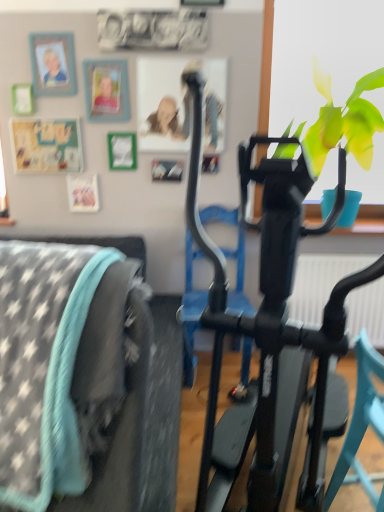
Image resolution: width=384 pixels, height=512 pixels. I want to click on wooden photo frame at upper left, marked as the second picture frame in a right-to-left arrangement, so click(x=53, y=64).

In order to face green leafy plant at upper right, should I rotate leftwards or rightwards?

To face it directly, rotate right by 18.413 degrees.

What do you see at coordinates (343, 122) in the screenshot? The height and width of the screenshot is (512, 384). I see `green leafy plant at upper right` at bounding box center [343, 122].

What is the approximate width of black matte stationary bicycle at center?

The width of black matte stationary bicycle at center is 1.34 meters.

At what (x,y) coordinates should I click in order to perform the action: click on black matte stationary bicycle at center. Please return your answer as a coordinate pair (x, y). The width and height of the screenshot is (384, 512). Looking at the image, I should click on (269, 306).

The height and width of the screenshot is (512, 384). I want to click on matte plastic picture frame at upper left, positioned as the 1th picture frame in right-to-left order, so [106, 90].

Locate an element on the screen. wooden photo frame at upper left, the 1th picture frame in the left-to-right sequence is located at coordinates (53, 64).

From their relative heights in the image, would you say wooden photo frame at upper left, the 1th picture frame in the left-to-right sequence, is taller or shorter than matte plastic picture frame at upper left, the 2th picture frame positioned from the left?

Clearly, wooden photo frame at upper left, the 1th picture frame in the left-to-right sequence, is shorter compared to matte plastic picture frame at upper left, the 2th picture frame positioned from the left.

Is wooden photo frame at upper left, marked as the second picture frame in a right-to-left arrangement, touching matte plastic picture frame at upper left, positioned as the 1th picture frame in right-to-left order?

No, wooden photo frame at upper left, marked as the second picture frame in a right-to-left arrangement, is not making contact with matte plastic picture frame at upper left, positioned as the 1th picture frame in right-to-left order.

Who is smaller, wooden photo frame at upper left, the 1th picture frame in the left-to-right sequence, or matte plastic picture frame at upper left, positioned as the 1th picture frame in right-to-left order?

With smaller size is wooden photo frame at upper left, the 1th picture frame in the left-to-right sequence.

Is wooden photo frame at upper left, marked as the second picture frame in a right-to-left arrangement, turned away from matte plastic picture frame at upper left, positioned as the 1th picture frame in right-to-left order?

No, wooden photo frame at upper left, marked as the second picture frame in a right-to-left arrangement,'s orientation is not away from matte plastic picture frame at upper left, positioned as the 1th picture frame in right-to-left order.

Can you confirm if wooden photo frame at upper left, the 1th picture frame in the left-to-right sequence, is positioned to the left of teal plastic chair at center?

Yes, wooden photo frame at upper left, the 1th picture frame in the left-to-right sequence, is to the left of teal plastic chair at center.

Who is shorter, wooden photo frame at upper left, marked as the second picture frame in a right-to-left arrangement, or teal plastic chair at center?

Standing shorter between the two is wooden photo frame at upper left, marked as the second picture frame in a right-to-left arrangement.

Is wooden photo frame at upper left, marked as the second picture frame in a right-to-left arrangement, in front of teal plastic chair at center?

That is False.

Are black matte stationary bicycle at center and green leafy plant at upper right beside each other?

No, black matte stationary bicycle at center is not with green leafy plant at upper right.

Is black matte stationary bicycle at center closer to camera compared to green leafy plant at upper right?

Yes.

Considering the relative positions of black matte stationary bicycle at center and green leafy plant at upper right in the image provided, is black matte stationary bicycle at center to the left of green leafy plant at upper right from the viewer's perspective?

Correct, you'll find black matte stationary bicycle at center to the left of green leafy plant at upper right.

From the image's perspective, which one is positioned lower, black matte stationary bicycle at center or green leafy plant at upper right?

black matte stationary bicycle at center.

From the image's perspective, would you say matte plastic picture frame at upper left, positioned as the 1th picture frame in right-to-left order, is positioned over green leafy plant at upper right?

Correct, matte plastic picture frame at upper left, positioned as the 1th picture frame in right-to-left order, appears higher than green leafy plant at upper right in the image.

The width and height of the screenshot is (384, 512). What are the coordinates of `picture frame directly beneath the green leafy plant at upper right (from a real-world perspective)` in the screenshot? It's located at (106, 90).

From a real-world perspective, is matte plastic picture frame at upper left, the 2th picture frame positioned from the left, above or below green leafy plant at upper right?

In terms of real-world spatial position, matte plastic picture frame at upper left, the 2th picture frame positioned from the left, is below green leafy plant at upper right.

Is matte plastic picture frame at upper left, positioned as the 1th picture frame in right-to-left order, far away from green leafy plant at upper right?

Yes.

In order to click on the 1st picture frame behind the green leafy plant at upper right, counting from the anchor's position in this screenshot , I will do `click(53, 64)`.

Which of these two, wooden photo frame at upper left, marked as the second picture frame in a right-to-left arrangement, or green leafy plant at upper right, is smaller?

wooden photo frame at upper left, marked as the second picture frame in a right-to-left arrangement, is smaller.

Is wooden photo frame at upper left, the 1th picture frame in the left-to-right sequence, with green leafy plant at upper right?

There is a gap between wooden photo frame at upper left, the 1th picture frame in the left-to-right sequence, and green leafy plant at upper right.

From a real-world perspective, which picture frame is the 2nd one above the black matte stationary bicycle at center? Please provide its 2D coordinates.

[(53, 64)]

From a real-world perspective, is wooden photo frame at upper left, the 1th picture frame in the left-to-right sequence, above or below black matte stationary bicycle at center?

From a real-world perspective, wooden photo frame at upper left, the 1th picture frame in the left-to-right sequence, is physically above black matte stationary bicycle at center.

Can you confirm if wooden photo frame at upper left, marked as the second picture frame in a right-to-left arrangement, is thinner than black matte stationary bicycle at center?

Yes, wooden photo frame at upper left, marked as the second picture frame in a right-to-left arrangement, is thinner than black matte stationary bicycle at center.

From the image's perspective, which one is positioned higher, wooden photo frame at upper left, the 1th picture frame in the left-to-right sequence, or black matte stationary bicycle at center?

wooden photo frame at upper left, the 1th picture frame in the left-to-right sequence, appears higher in the image.

Does black matte stationary bicycle at center have a lesser height compared to teal plastic chair at center?

In fact, black matte stationary bicycle at center may be taller than teal plastic chair at center.

Can you confirm if black matte stationary bicycle at center is bigger than teal plastic chair at center?

Indeed, black matte stationary bicycle at center has a larger size compared to teal plastic chair at center.

Which is behind, black matte stationary bicycle at center or teal plastic chair at center?

teal plastic chair at center is more distant.

How distant is black matte stationary bicycle at center from teal plastic chair at center?

black matte stationary bicycle at center and teal plastic chair at center are 12.18 inches apart.

This screenshot has width=384, height=512. I want to click on picture frame located in front of the matte plastic picture frame at upper left, the 2th picture frame positioned from the left, so click(x=53, y=64).

In order to click on chair below the wooden photo frame at upper left, the 1th picture frame in the left-to-right sequence (from the image's perspective) in this screenshot , I will do `click(361, 425)`.

When comparing their distances from wooden photo frame at upper left, marked as the second picture frame in a right-to-left arrangement, does teal plastic chair at center or black matte stationary bicycle at center seem further?

Among the two, teal plastic chair at center is located further to wooden photo frame at upper left, marked as the second picture frame in a right-to-left arrangement.

Which object lies nearer to the anchor point black matte stationary bicycle at center, matte plastic picture frame at upper left, positioned as the 1th picture frame in right-to-left order, or wooden photo frame at upper left, marked as the second picture frame in a right-to-left arrangement?

The object closer to black matte stationary bicycle at center is matte plastic picture frame at upper left, positioned as the 1th picture frame in right-to-left order.

Looking at the image, which one is located further to green leafy plant at upper right, black matte stationary bicycle at center or teal plastic chair at center?

teal plastic chair at center lies further to green leafy plant at upper right than the other object.

From the image, which object appears to be farther from matte plastic picture frame at upper left, the 2th picture frame positioned from the left, wooden photo frame at upper left, the 1th picture frame in the left-to-right sequence, or teal plastic chair at center?

teal plastic chair at center lies further to matte plastic picture frame at upper left, the 2th picture frame positioned from the left, than the other object.

Which object lies further to the anchor point teal plastic chair at center, black matte stationary bicycle at center or green leafy plant at upper right?

green leafy plant at upper right.

When comparing their distances from matte plastic picture frame at upper left, positioned as the 1th picture frame in right-to-left order, does teal plastic chair at center or black matte stationary bicycle at center seem closer?

The object closer to matte plastic picture frame at upper left, positioned as the 1th picture frame in right-to-left order, is black matte stationary bicycle at center.

From the picture: Looking at the image, which one is located further to green leafy plant at upper right, teal plastic chair at center or wooden photo frame at upper left, the 1th picture frame in the left-to-right sequence?

teal plastic chair at center is further to green leafy plant at upper right.

From the picture: Based on their spatial positions, is green leafy plant at upper right or black matte stationary bicycle at center closer to teal plastic chair at center?

black matte stationary bicycle at center is closer to teal plastic chair at center.

Where is `picture frame between wooden photo frame at upper left, marked as the second picture frame in a right-to-left arrangement, and teal plastic chair at center from top to bottom`? The width and height of the screenshot is (384, 512). picture frame between wooden photo frame at upper left, marked as the second picture frame in a right-to-left arrangement, and teal plastic chair at center from top to bottom is located at coordinates (106, 90).

Where is `flower between matte plastic picture frame at upper left, the 2th picture frame positioned from the left, and teal plastic chair at center vertically`? flower between matte plastic picture frame at upper left, the 2th picture frame positioned from the left, and teal plastic chair at center vertically is located at coordinates (343, 122).

Find the location of a particular element. Image resolution: width=384 pixels, height=512 pixels. chair positioned between black matte stationary bicycle at center and matte plastic picture frame at upper left, positioned as the 1th picture frame in right-to-left order, from near to far is located at coordinates (361, 425).

This screenshot has height=512, width=384. I want to click on stationary bicycle between green leafy plant at upper right and teal plastic chair at center in the vertical direction, so click(269, 306).